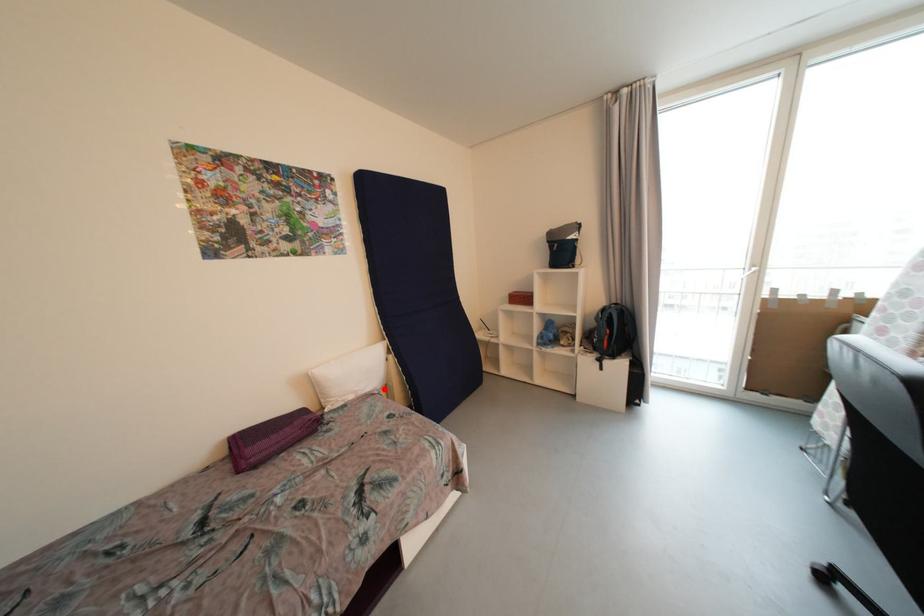
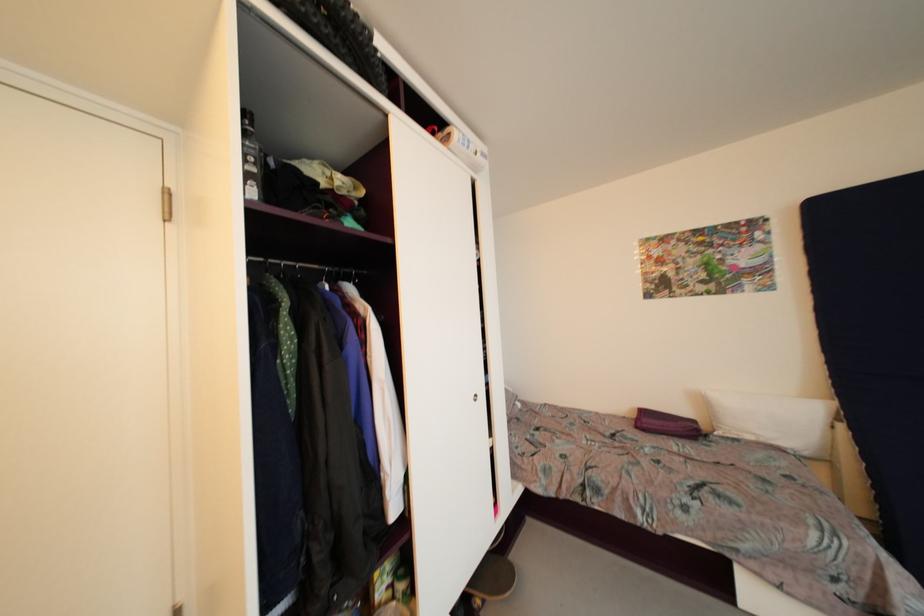
The point at the highlighted location is marked in the first image. Where is the corresponding point in the second image?

(810, 456)